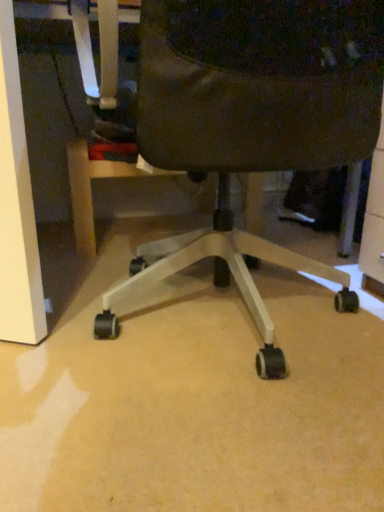
Identify the location of free point below black leather chair at center (from a real-world perspective). This screenshot has width=384, height=512. (240, 330).